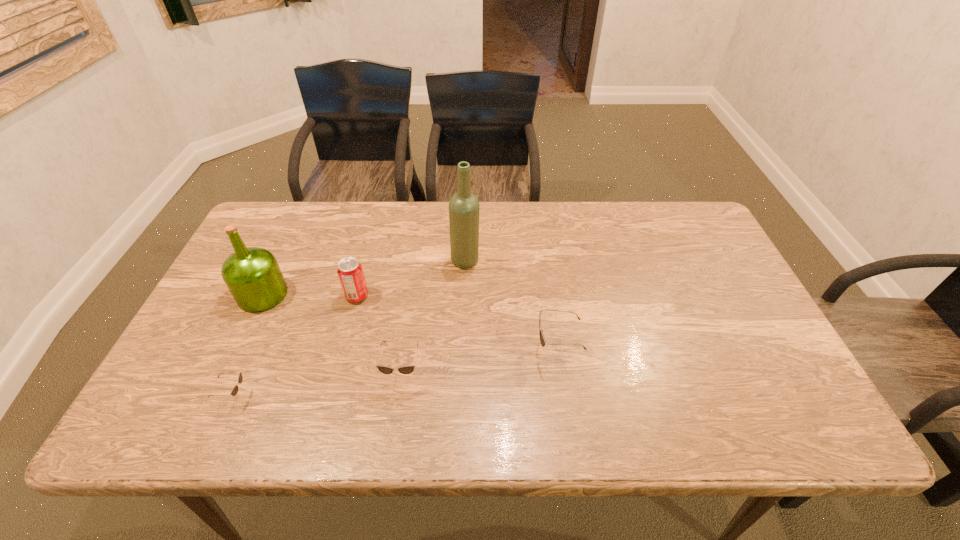
The height and width of the screenshot is (540, 960). What are the coordinates of `vacant region that satisfies the following two spatial constraints: 1. on the front side of the olive oil; 2. on the left side of the third object from left to right` in the screenshot? It's located at (262, 296).

Where is `free location that satisfies the following two spatial constraints: 1. in front of the lenses of the rightmost sunglasses; 2. in front of the lenses of the second shortest sunglasses`? This screenshot has width=960, height=540. free location that satisfies the following two spatial constraints: 1. in front of the lenses of the rightmost sunglasses; 2. in front of the lenses of the second shortest sunglasses is located at coordinates (560, 372).

This screenshot has width=960, height=540. Identify the location of vacant space that satisfies the following two spatial constraints: 1. in front of the lenses of the second shortest sunglasses; 2. in front of the lenses of the leftmost sunglasses. (398, 396).